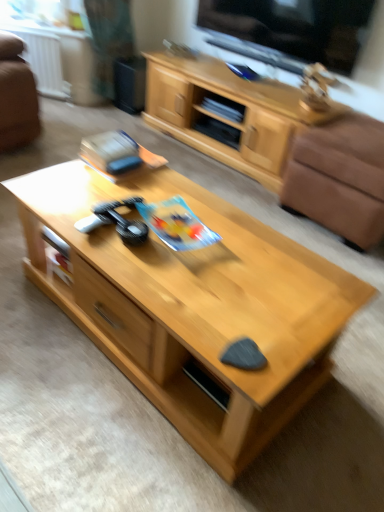
Question: Is light wood coffee table at center aimed at brown leather armchair at right?

Choices:
 (A) yes
 (B) no

Answer: (A)

Question: Is brown leather armchair at right completely or partially inside light wood coffee table at center?

Choices:
 (A) no
 (B) yes

Answer: (A)

Question: Is light wood coffee table at center shorter than brown leather armchair at right?

Choices:
 (A) yes
 (B) no

Answer: (A)

Question: Is light wood coffee table at center at the left side of brown leather armchair at right?

Choices:
 (A) yes
 (B) no

Answer: (A)

Question: Is light wood coffee table at center positioned before brown leather armchair at right?

Choices:
 (A) no
 (B) yes

Answer: (B)

Question: Does light wood coffee table at center lie behind brown leather armchair at right?

Choices:
 (A) no
 (B) yes

Answer: (A)

Question: From a real-world perspective, does brown leather armchair at right stand above light wood cabinet at upper center?

Choices:
 (A) yes
 (B) no

Answer: (B)

Question: Is brown leather armchair at right outside of light wood cabinet at upper center?

Choices:
 (A) no
 (B) yes

Answer: (B)

Question: Does brown leather armchair at right have a lesser width compared to light wood cabinet at upper center?

Choices:
 (A) no
 (B) yes

Answer: (A)

Question: Can you confirm if brown leather armchair at right is shorter than light wood cabinet at upper center?

Choices:
 (A) yes
 (B) no

Answer: (A)

Question: Is brown leather armchair at right at the right side of light wood cabinet at upper center?

Choices:
 (A) no
 (B) yes

Answer: (B)

Question: Is light wood cabinet at upper center located within brown leather armchair at right?

Choices:
 (A) no
 (B) yes

Answer: (A)

Question: Is black glossy tv at upper center to the right of white plastic radiator at upper left from the viewer's perspective?

Choices:
 (A) no
 (B) yes

Answer: (B)